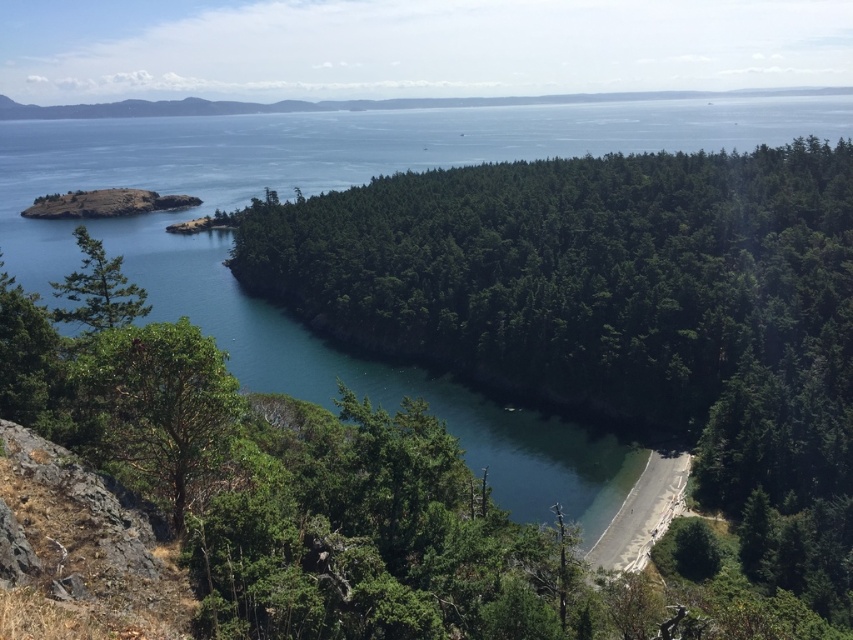
You are a hiker who wants to set up a tent. You have two options for the campsite location. One is near the green rough bark tree at lower left, and the other is on the smooth sand beach at lower center. Which location has more space for your tent?

The smooth sand beach at lower center has more space because the green rough bark tree at lower left occupies less space than the smooth sand beach at lower center.